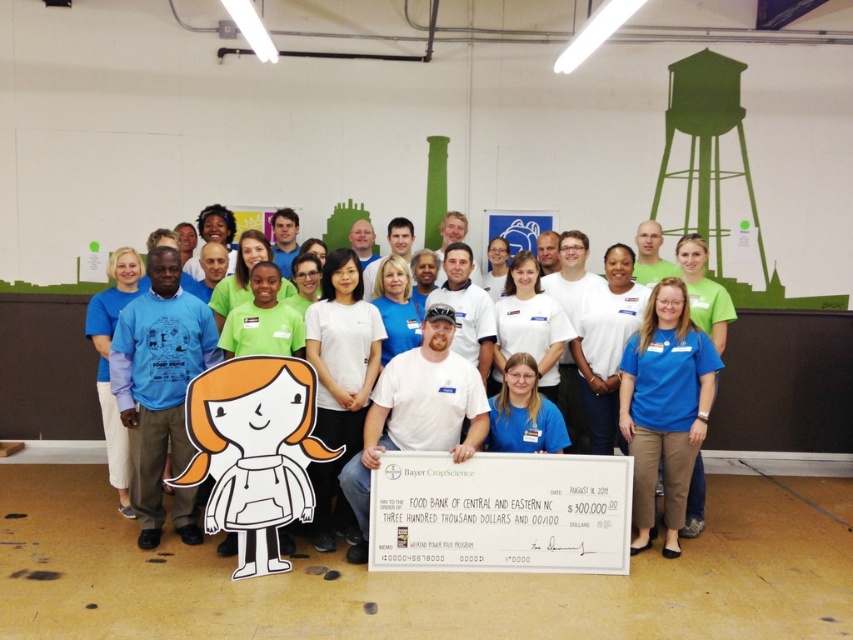
You are a photographer trying to capture a closeup of the white paper cutout at center without including the blue fabric shirt at center in the shot. Given their positions and sizes, is this possible?

The blue fabric shirt at center is narrower than the white paper cutout at center. Since the blue fabric shirt at center is smaller in width, it might be positioned in a way that allows the photographer to frame the shot so the white paper cutout at center is centered and the blue fabric shirt at center is out of the frame. However, this depends on their exact spatial arrangement not detailed here.

You are a photographer at the event and need to position a light to the left of the white paper cutout at center. Will the light be to the left or right of the blue fabric shirt at center?

The blue fabric shirt at center is to the right of the white paper cutout at center, so positioning the light to the left of the white paper cutout at center would place it to the left of the blue fabric shirt at center as well.

You are a photographer taking a group photo and need to ensure that the blue fabric shirt at center and the white paper cutout at center are at least 2 inches apart to avoid blurring. Based on the current setup, is this requirement met?

The blue fabric shirt at center is only 1.43 inches from the white paper cutout at center, which is less than the required 2 inches. Therefore, the requirement is not met, and adjustments are needed to increase the distance between them.